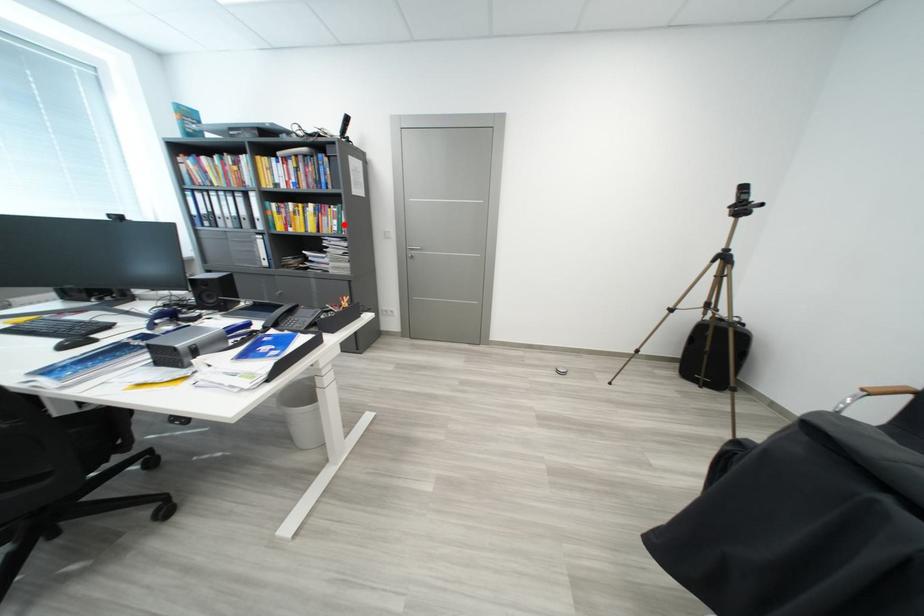
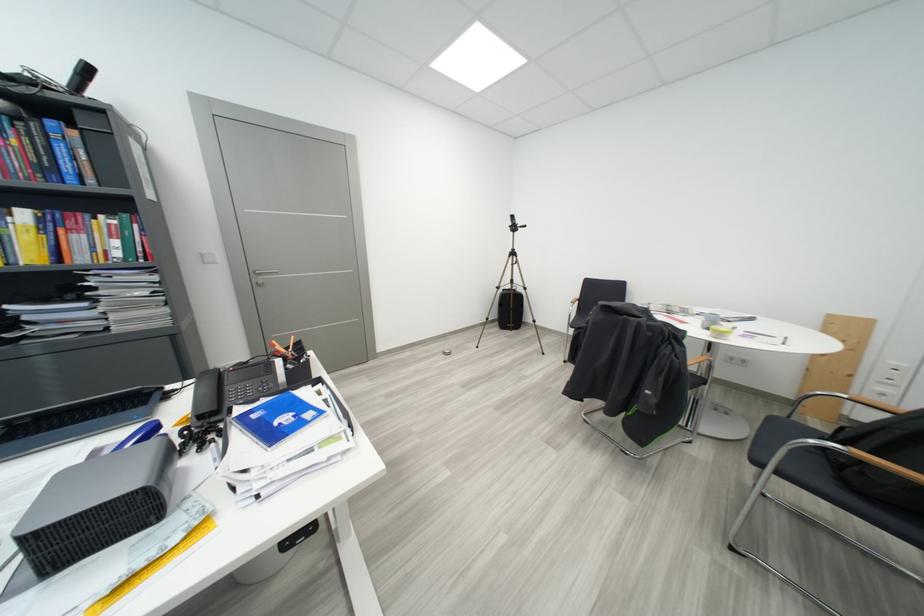
Question: I am providing you with two images of the same scene from different viewpoints. Image1 has a red point marked. In image2, the corresponding 3D location appears at what relative position? Reply with the corresponding letter.

Choices:
 (A) Closer
 (B) Farther

Answer: (B)